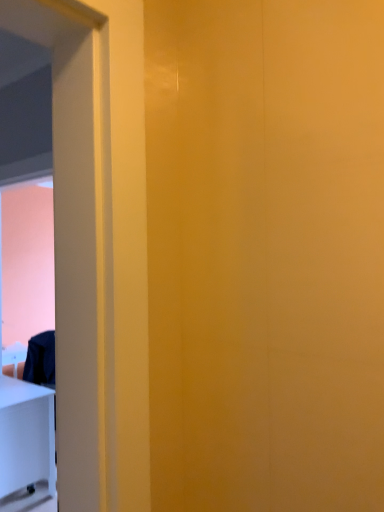
Question: From the image's perspective, is white glossy table at lower left located above white glossy screen door at left?

Choices:
 (A) yes
 (B) no

Answer: (B)

Question: From the image's perspective, is white glossy table at lower left located beneath white glossy screen door at left?

Choices:
 (A) no
 (B) yes

Answer: (B)

Question: Is white glossy table at lower left wider than white glossy screen door at left?

Choices:
 (A) no
 (B) yes

Answer: (B)

Question: From a real-world perspective, is white glossy table at lower left positioned under white glossy screen door at left based on gravity?

Choices:
 (A) no
 (B) yes

Answer: (B)

Question: From a real-world perspective, is white glossy table at lower left located higher than white glossy screen door at left?

Choices:
 (A) no
 (B) yes

Answer: (A)

Question: Does white glossy table at lower left have a larger size compared to white glossy screen door at left?

Choices:
 (A) yes
 (B) no

Answer: (B)

Question: Is white glossy table at lower left surrounded by white glossy screen door at left?

Choices:
 (A) no
 (B) yes

Answer: (A)

Question: Can you see white glossy screen door at left touching white glossy table at lower left?

Choices:
 (A) yes
 (B) no

Answer: (A)

Question: Does white glossy screen door at left have a lesser height compared to white glossy table at lower left?

Choices:
 (A) yes
 (B) no

Answer: (B)

Question: From the image's perspective, is white glossy screen door at left located above white glossy table at lower left?

Choices:
 (A) yes
 (B) no

Answer: (A)

Question: Is white glossy screen door at left wider than white glossy table at lower left?

Choices:
 (A) no
 (B) yes

Answer: (A)

Question: Is white glossy screen door at left facing away from white glossy table at lower left?

Choices:
 (A) yes
 (B) no

Answer: (B)

Question: In the image, is white glossy table at lower left on the left side or the right side of white glossy screen door at left?

Choices:
 (A) left
 (B) right

Answer: (A)